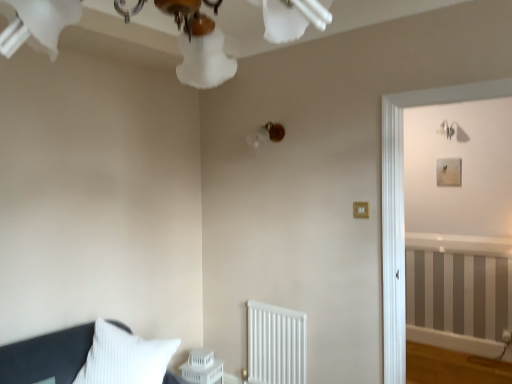
Describe the element at coordinates (203, 373) in the screenshot. I see `white plastic table at lower center` at that location.

Measure the distance between white frosted glass chandelier at upper center and camera.

23.47 inches.

Image resolution: width=512 pixels, height=384 pixels. Find the location of `white matte radiator at lower center`. white matte radiator at lower center is located at coordinates (276, 345).

Is white plastic table at lower center taller or shorter than gold metallic light switch at center-right?

In the image, white plastic table at lower center appears to be taller than gold metallic light switch at center-right.

Considering the relative positions of white plastic table at lower center and gold metallic light switch at center-right in the image provided, is white plastic table at lower center to the left or to the right of gold metallic light switch at center-right?

In the image, white plastic table at lower center appears on the left side of gold metallic light switch at center-right.

Is gold metallic light switch at center-right at the back of white plastic table at lower center?

white plastic table at lower center is not turned away from gold metallic light switch at center-right.

What's the angular difference between gold metallic light switch at center-right and white matte radiator at lower center's facing directions?

2.43 degrees.

I want to click on light switch in front of the white matte radiator at lower center, so click(361, 210).

Between gold metallic light switch at center-right and white matte radiator at lower center, which one has larger size?

Bigger between the two is white matte radiator at lower center.

Image resolution: width=512 pixels, height=384 pixels. Identify the location of lamp lying above the gold metallic light switch at center-right (from the image's perspective). (266, 134).

Is gold metallic light switch at center-right far from matte brown lampshade at upper center?

No, gold metallic light switch at center-right is in close proximity to matte brown lampshade at upper center.

Is gold metallic light switch at center-right to the left of matte brown lampshade at upper center from the viewer's perspective?

No.

From the image's perspective, is white plastic table at lower center above or below white frosted glass chandelier at upper center?

Answer: white plastic table at lower center is below white frosted glass chandelier at upper center.

Which object is more forward, white plastic table at lower center or white frosted glass chandelier at upper center?

Positioned in front is white frosted glass chandelier at upper center.

Between point (207, 383) and point (185, 59), which one is positioned in front?

The point (185, 59) is more forward.

From the image's perspective, who appears lower, matte brown lampshade at upper center or white frosted glass chandelier at upper center?

white frosted glass chandelier at upper center, from the image's perspective.

Between matte brown lampshade at upper center and white frosted glass chandelier at upper center, which one has less height?

matte brown lampshade at upper center.

Considering the sizes of matte brown lampshade at upper center and white frosted glass chandelier at upper center in the image, is matte brown lampshade at upper center bigger or smaller than white frosted glass chandelier at upper center?

Clearly, matte brown lampshade at upper center is smaller in size than white frosted glass chandelier at upper center.

Can you see matte brown lampshade at upper center touching white frosted glass chandelier at upper center?

No, matte brown lampshade at upper center is not next to white frosted glass chandelier at upper center.

Is white frosted glass chandelier at upper center turned away from white matte radiator at lower center?

No, white frosted glass chandelier at upper center's orientation is not away from white matte radiator at lower center.

From a real-world perspective, which object stands above the other?

white frosted glass chandelier at upper center is physically above.

Would you say white frosted glass chandelier at upper center contains white matte radiator at lower center?

No, white matte radiator at lower center is not a part of white frosted glass chandelier at upper center.

Which is nearer, (211, 56) or (272, 380)?

Point (211, 56) is positioned closer to the camera compared to point (272, 380).

Is point (274, 129) positioned behind point (183, 372)?

That is False.

In order to click on lamp in front of the white plastic table at lower center in this screenshot , I will do [266, 134].

Is matte brown lampshade at upper center facing away from white plastic table at lower center?

No.

From a real-world perspective, which object rests below the other?

From a 3D spatial view, white plastic table at lower center is below.

Image resolution: width=512 pixels, height=384 pixels. What are the coordinates of `light switch above the white plastic table at lower center (from a real-world perspective)` in the screenshot? It's located at (361, 210).

Identify the location of radiator located below the gold metallic light switch at center-right (from the image's perspective). This screenshot has width=512, height=384. (276, 345).

Considering their positions, is gold metallic light switch at center-right positioned further to matte brown lampshade at upper center than white matte radiator at lower center?

white matte radiator at lower center is positioned further to the anchor matte brown lampshade at upper center.

Looking at the image, which one is located further to gold metallic light switch at center-right, white plastic table at lower center or matte brown lampshade at upper center?

Among the two, white plastic table at lower center is located further to gold metallic light switch at center-right.

From the image, which object appears to be farther from matte brown lampshade at upper center, gold metallic light switch at center-right or white frosted glass chandelier at upper center?

Based on the image, white frosted glass chandelier at upper center appears to be further to matte brown lampshade at upper center.

When comparing their distances from matte brown lampshade at upper center, does white matte radiator at lower center or white plastic table at lower center seem further?

The object further to matte brown lampshade at upper center is white plastic table at lower center.

Based on the photo, from the image, which object appears to be farther from white plastic table at lower center, white matte radiator at lower center or gold metallic light switch at center-right?

gold metallic light switch at center-right lies further to white plastic table at lower center than the other object.

Looking at the image, which one is located closer to white frosted glass chandelier at upper center, gold metallic light switch at center-right or white plastic table at lower center?

Based on the image, gold metallic light switch at center-right appears to be nearer to white frosted glass chandelier at upper center.

Considering their positions, is white frosted glass chandelier at upper center positioned further to gold metallic light switch at center-right than white plastic table at lower center?

white frosted glass chandelier at upper center is further to gold metallic light switch at center-right.

Based on their spatial positions, is white plastic table at lower center or white matte radiator at lower center closer to matte brown lampshade at upper center?

white matte radiator at lower center.

Locate an element on the screen. The height and width of the screenshot is (384, 512). light switch between white frosted glass chandelier at upper center and white plastic table at lower center along the z-axis is located at coordinates (361, 210).

The height and width of the screenshot is (384, 512). In order to click on light switch between matte brown lampshade at upper center and white matte radiator at lower center vertically in this screenshot , I will do `click(361, 210)`.

Identify the location of light switch between matte brown lampshade at upper center and white plastic table at lower center from top to bottom. The image size is (512, 384). (361, 210).

Locate an element on the screen. radiator that lies between gold metallic light switch at center-right and white plastic table at lower center from top to bottom is located at coordinates (276, 345).